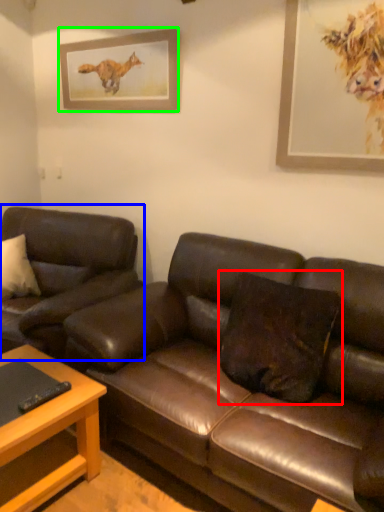
Question: Estimate the real-world distances between objects in this image. Which object is farther from pillow (highlighted by a red box), studio couch (highlighted by a blue box) or picture frame (highlighted by a green box)?

Choices:
 (A) studio couch
 (B) picture frame

Answer: (B)